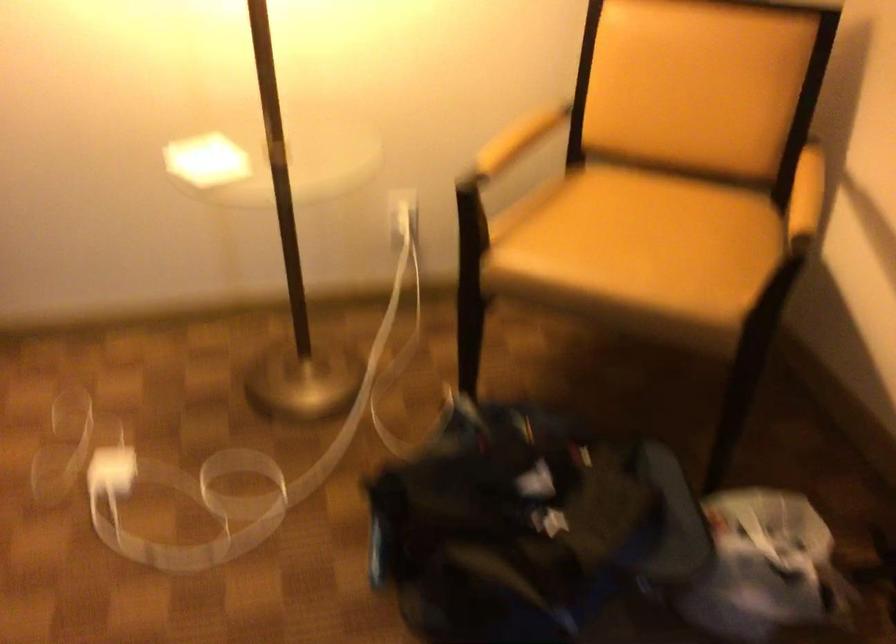
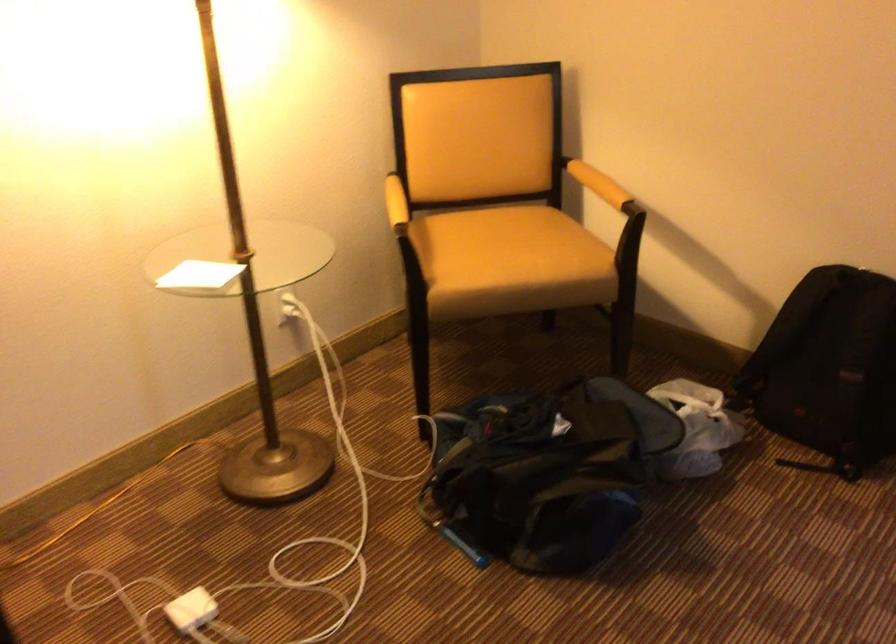
Where in the second image is the point corresponding to (x=606, y=254) from the first image?

(510, 261)